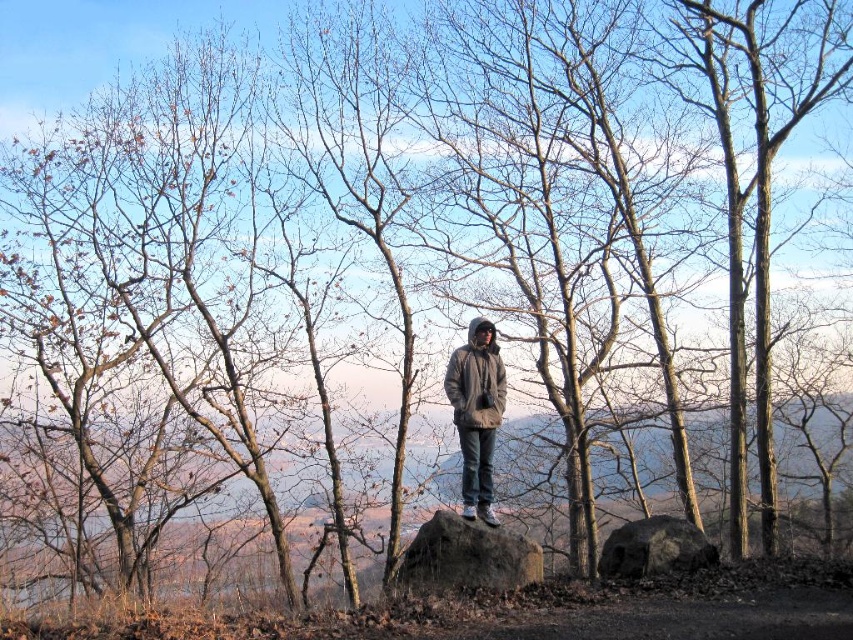
Can you confirm if brown rough boulder at center is positioned to the right of gray woolen jacket at center?

Incorrect, brown rough boulder at center is not on the right side of gray woolen jacket at center.

Who is more distant from viewer, [442,566] or [498,390]?

Point [498,390]

Locate an element on the screen. This screenshot has height=640, width=853. brown rough boulder at center is located at coordinates (467, 556).

Between point (474, 532) and point (625, 525), which one is positioned in front?

Point (474, 532)

Does brown rough boulder at center have a lesser width compared to dark gray rock at center?

Incorrect, brown rough boulder at center's width is not less than dark gray rock at center's.

Is point (474, 586) closer to viewer compared to point (668, 572)?

Yes, it is.

The image size is (853, 640). What are the coordinates of `brown rough boulder at center` in the screenshot? It's located at (467, 556).

Can you confirm if dark gray rock at center is bigger than gray woolen jacket at center?

Yes, dark gray rock at center is bigger than gray woolen jacket at center.

Is dark gray rock at center smaller than gray woolen jacket at center?

Incorrect, dark gray rock at center is not smaller in size than gray woolen jacket at center.

Between point (688, 552) and point (479, 365), which one is positioned behind?

Positioned behind is point (479, 365).

Find the location of `dark gray rock at center`. dark gray rock at center is located at coordinates (654, 548).